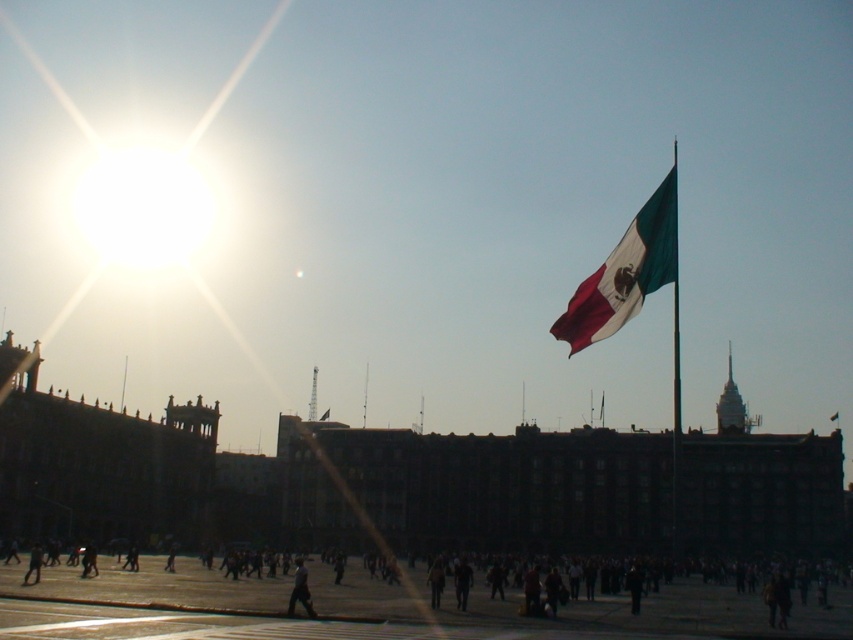
You are a photographer trying to capture a wide shot of the public square. The textured cotton flag at upper right and the dark gray fabric person at center are both in your frame. Based on their sizes, which object will appear larger in your photo?

The textured cotton flag at upper right will appear larger in the photo because its width surpasses that of the dark gray fabric person at center.

From the picture: You are a photographer standing in the public square and want to capture a photo of the dark clothing at center and the textured cotton flag at upper right. Which object is positioned higher in the frame?

The textured cotton flag at upper right is positioned higher in the frame than the dark clothing at center.

You are standing in the public square and want to take a photo of the dark gray fabric person at center without the textured cotton flag at upper right appearing in the frame. Which direction should you move to achieve this?

Move to the right side of the dark gray fabric person at center so that the textured cotton flag at upper right is no longer in the frame.